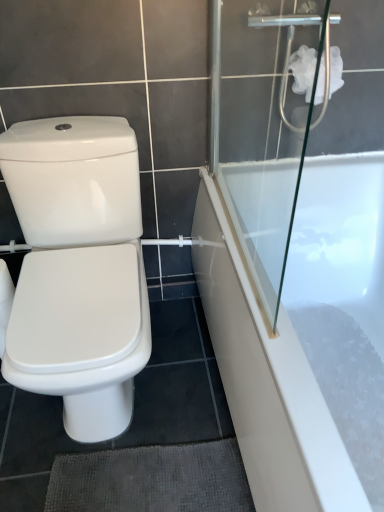
Where is `transparent glass shower door at upper right`? The width and height of the screenshot is (384, 512). transparent glass shower door at upper right is located at coordinates (269, 134).

Locate an element on the screen. Image resolution: width=384 pixels, height=512 pixels. white glossy bathtub at right is located at coordinates (300, 326).

Measure the distance from white glossy bathtub at right to transparent glass shower door at upper right.

white glossy bathtub at right is 7.85 inches from transparent glass shower door at upper right.

Considering the sizes of objects white glossy bathtub at right and transparent glass shower door at upper right in the image provided, who is thinner, white glossy bathtub at right or transparent glass shower door at upper right?

transparent glass shower door at upper right.

How different are the orientations of white glossy bathtub at right and transparent glass shower door at upper right in degrees?

1.11 degrees separate the facing orientations of white glossy bathtub at right and transparent glass shower door at upper right.

Are white glossy bathtub at right and transparent glass shower door at upper right far apart?

white glossy bathtub at right is near transparent glass shower door at upper right, not far away.

Does white fluffy toilet paper at upper right have a greater height compared to white glossy bathtub at right?

No.

Which of these two, white fluffy toilet paper at upper right or white glossy bathtub at right, is thinner?

With smaller width is white fluffy toilet paper at upper right.

Considering the relative positions of white fluffy toilet paper at upper right and white glossy bathtub at right in the image provided, is white fluffy toilet paper at upper right in front of white glossy bathtub at right?

That is False.

From the image's perspective, is white fluffy toilet paper at upper right above or below white glossy bathtub at right?

white fluffy toilet paper at upper right is above white glossy bathtub at right.

Could you tell me if transparent glass shower door at upper right is facing white glossy bidet at left?

No.

From the image's perspective, would you say transparent glass shower door at upper right is positioned over white glossy bidet at left?

Indeed, from the image's perspective, transparent glass shower door at upper right is shown above white glossy bidet at left.

Which is nearer, (259,70) or (89,279)?

Point (259,70) is farther from the camera than point (89,279).

Identify the location of bidet below the transparent glass shower door at upper right (from the image's perspective). click(x=81, y=334).

Are white glossy bidet at left and transparent glass shower door at upper right beside each other?

No, white glossy bidet at left is not beside transparent glass shower door at upper right.

From a real-world perspective, which is physically above, white glossy bidet at left or transparent glass shower door at upper right?

In real-world perspective, transparent glass shower door at upper right is above.

Is white glossy bidet at left inside the boundaries of transparent glass shower door at upper right, or outside?

white glossy bidet at left is outside transparent glass shower door at upper right.

From the image's perspective, which one is positioned lower, white glossy bidet at left or transparent glass shower door at upper right?

From the image's view, white glossy bidet at left is below.

This screenshot has width=384, height=512. I want to click on shower door in front of the white glossy bathtub at right, so click(x=269, y=134).

In terms of height, does transparent glass shower door at upper right look taller or shorter compared to white glossy bathtub at right?

transparent glass shower door at upper right is taller than white glossy bathtub at right.

Which object is wider, transparent glass shower door at upper right or white glossy bathtub at right?

Wider between the two is white glossy bathtub at right.

Can you confirm if transparent glass shower door at upper right is positioned to the left of white glossy bathtub at right?

Indeed, transparent glass shower door at upper right is positioned on the left side of white glossy bathtub at right.

Is point (351, 211) closer to camera compared to point (298, 67)?

No, (351, 211) is behind (298, 67).

Looking at this image, is white glossy bathtub at right to the left of white fluffy toilet paper at upper right from the viewer's perspective?

No.

Is white glossy bathtub at right inside the boundaries of white fluffy toilet paper at upper right, or outside?

white glossy bathtub at right is not inside white fluffy toilet paper at upper right, it's outside.

Does white glossy bathtub at right have a greater height compared to white fluffy toilet paper at upper right?

Indeed, white glossy bathtub at right has a greater height compared to white fluffy toilet paper at upper right.

Which is in front, point (292, 65) or point (97, 271)?

The point (97, 271) is closer.

From a real-world perspective, does white fluffy toilet paper at upper right sit lower than white glossy bidet at left?

No, from a real-world perspective, white fluffy toilet paper at upper right is not under white glossy bidet at left.

Which of these two, white fluffy toilet paper at upper right or white glossy bidet at left, stands taller?

With more height is white glossy bidet at left.

Between white fluffy toilet paper at upper right and white glossy bidet at left, which one has smaller size?

Smaller between the two is white fluffy toilet paper at upper right.

I want to click on shower door to the left of white glossy bathtub at right, so click(269, 134).

At what (x,y) coordinates should I click in order to perform the action: click on bathtub on the right side of white fluffy toilet paper at upper right. Please return your answer as a coordinate pair (x, y). This screenshot has width=384, height=512. Looking at the image, I should click on (300, 326).

From the image, which object appears to be nearer to white fluffy toilet paper at upper right, white glossy bidet at left or transparent glass shower door at upper right?

The object closer to white fluffy toilet paper at upper right is transparent glass shower door at upper right.

When comparing their distances from transparent glass shower door at upper right, does white fluffy toilet paper at upper right or white glossy bathtub at right seem further?

white glossy bathtub at right lies further to transparent glass shower door at upper right than the other object.

Estimate the real-world distances between objects in this image. Which object is further from white glossy bidet at left, white fluffy toilet paper at upper right or transparent glass shower door at upper right?

white fluffy toilet paper at upper right.

When comparing their distances from white glossy bidet at left, does transparent glass shower door at upper right or white fluffy toilet paper at upper right seem closer?

transparent glass shower door at upper right is closer to white glossy bidet at left.

In the scene shown: Considering their positions, is white glossy bidet at left positioned closer to white fluffy toilet paper at upper right than white glossy bathtub at right?

white glossy bathtub at right lies closer to white fluffy toilet paper at upper right than the other object.

From the image, which object appears to be nearer to white glossy bidet at left, transparent glass shower door at upper right or white glossy bathtub at right?

Answer: Based on the image, white glossy bathtub at right appears to be nearer to white glossy bidet at left.

Based on their spatial positions, is transparent glass shower door at upper right or white glossy bidet at left further from white glossy bathtub at right?

Based on the image, white glossy bidet at left appears to be further to white glossy bathtub at right.

From the image, which object appears to be farther from transparent glass shower door at upper right, white glossy bathtub at right or white glossy bidet at left?

Based on the image, white glossy bidet at left appears to be further to transparent glass shower door at upper right.

The width and height of the screenshot is (384, 512). I want to click on shower door between white glossy bidet at left and white glossy bathtub at right in the horizontal direction, so click(x=269, y=134).

Where is `shower door located between white glossy bidet at left and white fluffy toilet paper at upper right in the left-right direction`? shower door located between white glossy bidet at left and white fluffy toilet paper at upper right in the left-right direction is located at coordinates (269, 134).

Where is `toilet paper situated between white glossy bidet at left and white glossy bathtub at right from left to right`? The width and height of the screenshot is (384, 512). toilet paper situated between white glossy bidet at left and white glossy bathtub at right from left to right is located at coordinates (303, 70).

At what (x,y) coordinates should I click in order to perform the action: click on shower door between white fluffy toilet paper at upper right and white glossy bathtub at right in the up-down direction. Please return your answer as a coordinate pair (x, y). The height and width of the screenshot is (512, 384). Looking at the image, I should click on (269, 134).